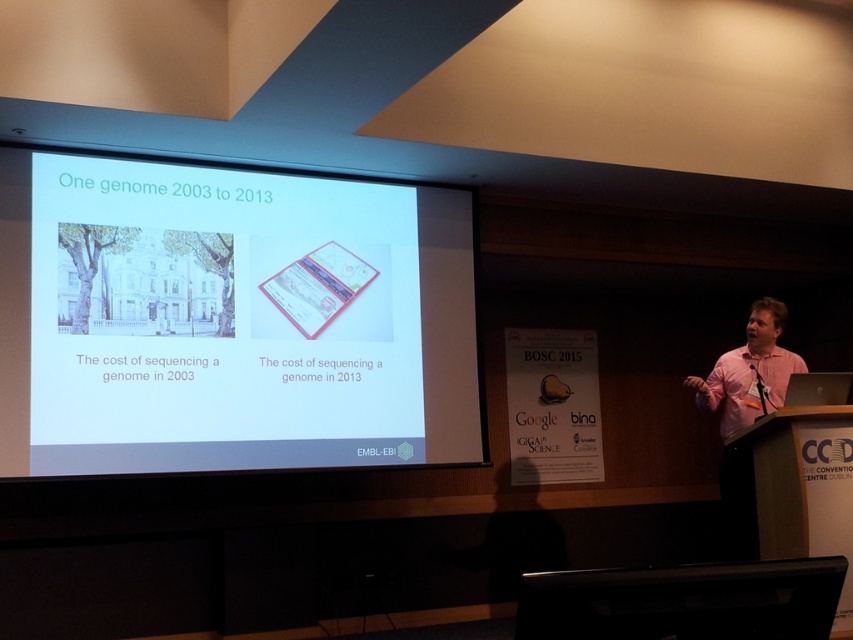
Is white paper at center above pink shirt at right?

Correct, white paper at center is located above pink shirt at right.

Is the position of white paper at center less distant than that of pink shirt at right?

Yes.

The image size is (853, 640). I want to click on white paper at center, so click(x=229, y=320).

Locate an element on the screen. The image size is (853, 640). white paper at center is located at coordinates (229, 320).